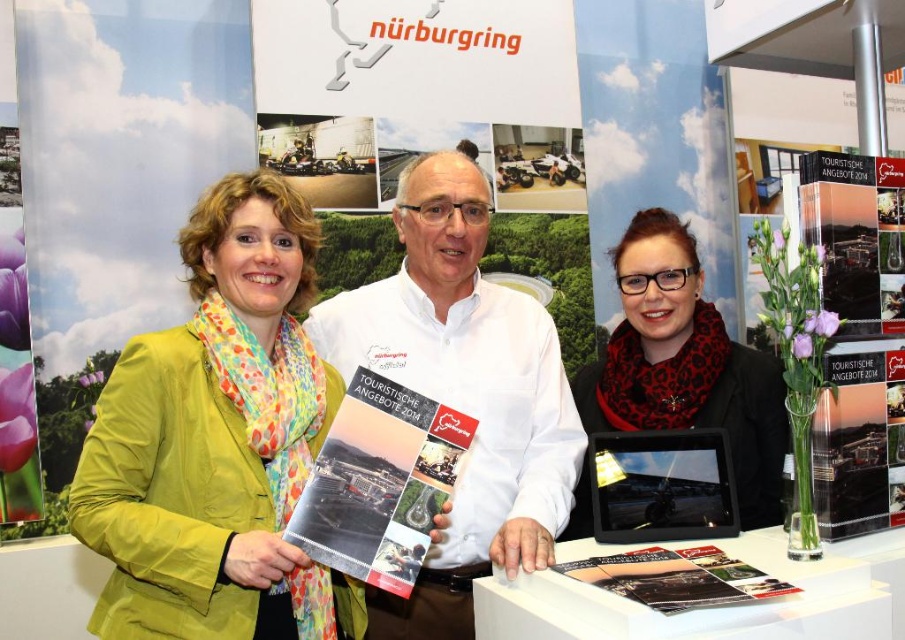
Which of these two, green fabric jacket at left or matte paper brochure at center, stands shorter?

matte paper brochure at center is shorter.

Measure the distance between point (270, 477) and camera.

Point (270, 477) is 1.35 meters away from camera.

This screenshot has height=640, width=905. Identify the location of green fabric jacket at left. (217, 442).

Who is shorter, white paper at center or matte paper brochure at center?

With less height is matte paper brochure at center.

Is white paper at center to the right of matte paper brochure at center from the viewer's perspective?

Correct, you'll find white paper at center to the right of matte paper brochure at center.

The image size is (905, 640). What are the coordinates of `white paper at center` in the screenshot? It's located at (463, 392).

Who is lower down, green fabric jacket at left or red scarf at center?

Positioned lower is green fabric jacket at left.

Is point (282, 634) in front of point (754, 364)?

That is True.

Describe the element at coordinates (217, 442) in the screenshot. Image resolution: width=905 pixels, height=640 pixels. I see `green fabric jacket at left` at that location.

The width and height of the screenshot is (905, 640). Identify the location of green fabric jacket at left. (217, 442).